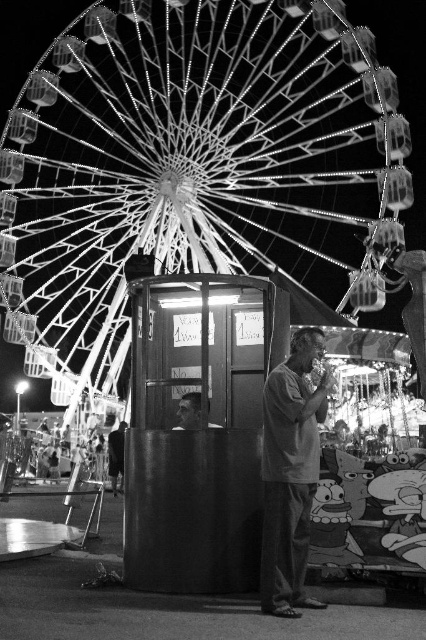
You are a photographer trying to capture the entire metallic ferris wheel at upper center and the smooth black shirt at center in one shot. Based on their widths, which object should you frame first to ensure both are fully visible in the photo?

The metallic ferris wheel at upper center is wider than the smooth black shirt at center. To ensure both are fully visible, you should frame the metallic ferris wheel at upper center first, as it requires more space in the shot.

You are a photographer trying to capture a clear image of both the matte gray shirt at center and the smooth black shirt at center. Since they are overlapping, which one will appear in front in the photo?

The matte gray shirt at center is positioned over smooth black shirt at center, so it will appear in front in the photo.

You are standing at the entrance of the fairground and see two points marked in the image. The first point is at coordinates point [261,573] and the second is at point [115,461]. Which point is closer to you?

Point [261,573] is closer to the viewer than point [115,461].